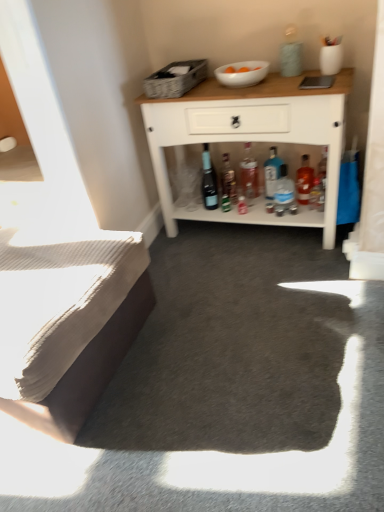
Find the location of a particular element. The height and width of the screenshot is (512, 384). free point above white wood cabinet at upper center (from a real-world perspective) is located at coordinates (245, 86).